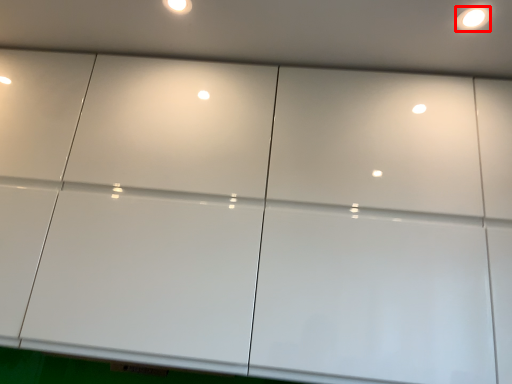
Question: From the image's perspective, considering the relative positions of light (annotated by the red box) and dot in the image provided, where is light (annotated by the red box) located with respect to the staircase?

Choices:
 (A) below
 (B) above

Answer: (A)